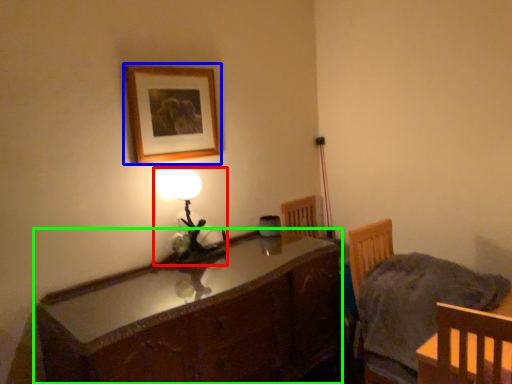
Question: Considering the real-world distances, which object is closest to lamp (highlighted by a red box)? picture frame (highlighted by a blue box) or cabinetry (highlighted by a green box).

Choices:
 (A) picture frame
 (B) cabinetry

Answer: (A)